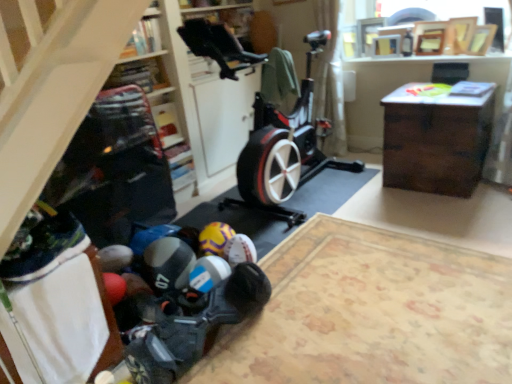
Question: From the image's perspective, is yellow matte soccer ball at lower center, the 1th toy when ordered from back to front, located above or below white sheer curtain at upper center?

Choices:
 (A) above
 (B) below

Answer: (B)

Question: Looking at the image, does yellow matte soccer ball at lower center, which is counted as the 2th toy, starting from the front, seem bigger or smaller compared to white sheer curtain at upper center?

Choices:
 (A) big
 (B) small

Answer: (B)

Question: Which is nearer to the rubberized black mat at lower left?

Choices:
 (A) white sheer curtain at upper center
 (B) wooden cabinet at center
 (C) yellow matte soccer ball at lower center, which is counted as the 2th toy, starting from the front
 (D) dark wood desk at right
 (E) rubberized plastic toy at lower center, the first toy when ordered from front to back

Answer: (E)

Question: Which is nearer to the rubberized black mat at lower left?

Choices:
 (A) matte plastic shelf at upper center, which is the 1th shelf from back to front
 (B) rubberized plastic toy at lower center, marked as the second toy in a back-to-front arrangement
 (C) wooden cabinet at center
 (D) dark wood desk at right
 (E) yellow matte soccer ball at lower center, the 1th toy when ordered from back to front

Answer: (B)